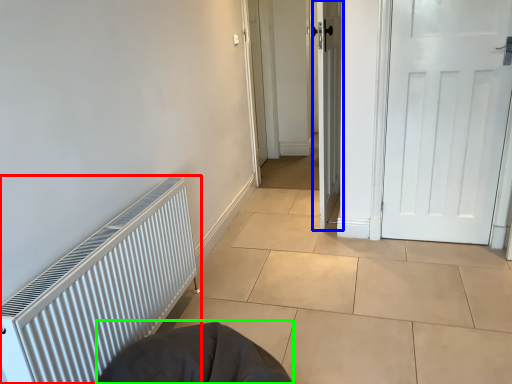
Question: Estimate the real-world distances between objects in this image. Which object is farther from radiator (highlighted by a red box), door (highlighted by a blue box) or sleeping bag (highlighted by a green box)?

Choices:
 (A) door
 (B) sleeping bag

Answer: (A)